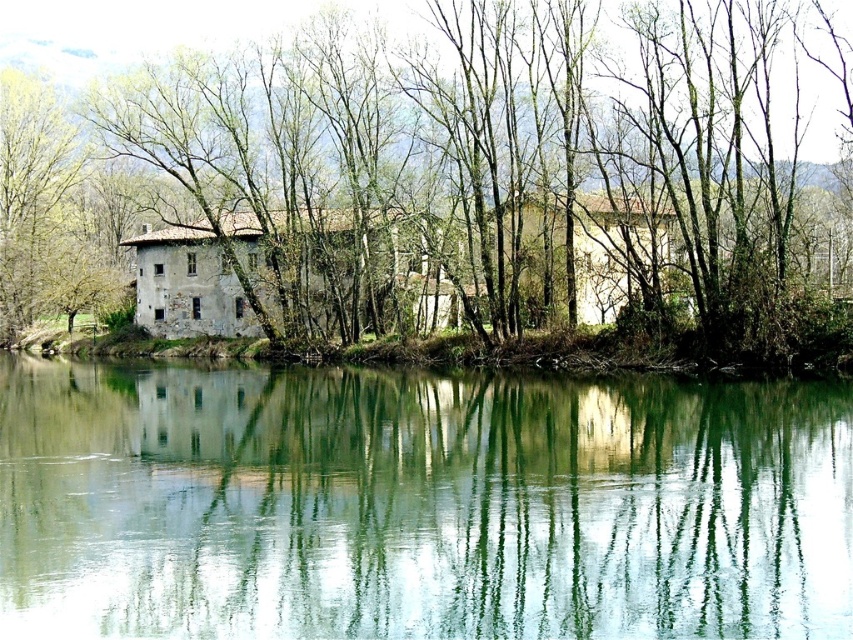
Is green reflective water at center bigger than green leafy tree at center?

Incorrect, green reflective water at center is not larger than green leafy tree at center.

Is green reflective water at center above green leafy tree at center?

Incorrect, green reflective water at center is not positioned above green leafy tree at center.

Which is in front, point (3, 621) or point (79, 80)?

Point (3, 621) is in front.

Identify the location of green reflective water at center. This screenshot has width=853, height=640. (418, 504).